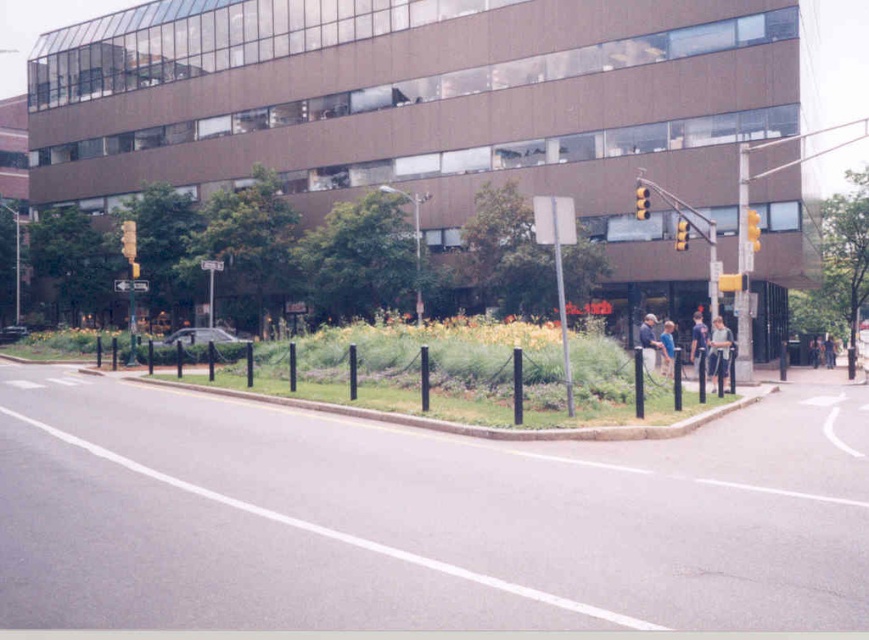
Question: Which object appears closest to the camera in this image?

Choices:
 (A) gray fabric jacket at lower right
 (B) yellow plastic traffic light at upper center

Answer: (A)

Question: Which of the following is the farthest from the observer?

Choices:
 (A) light brown leather jacket at center
 (B) yellow plastic traffic light at upper right
 (C) dark blue jeans at center
 (D) blue denim jeans at lower right

Answer: (D)

Question: Is light blue shirt at center bigger than yellow plastic traffic light at right?

Choices:
 (A) no
 (B) yes

Answer: (B)

Question: Can you confirm if gray fabric jacket at lower right is positioned above blue denim jeans at lower right?

Choices:
 (A) no
 (B) yes

Answer: (B)

Question: Is light brown leather jacket at center to the right of yellow plastic traffic light at right from the viewer's perspective?

Choices:
 (A) yes
 (B) no

Answer: (B)

Question: Which object is the closest to the light blue shirt at center?

Choices:
 (A) dark blue jeans at lower right
 (B) yellow matte traffic light at upper left

Answer: (A)